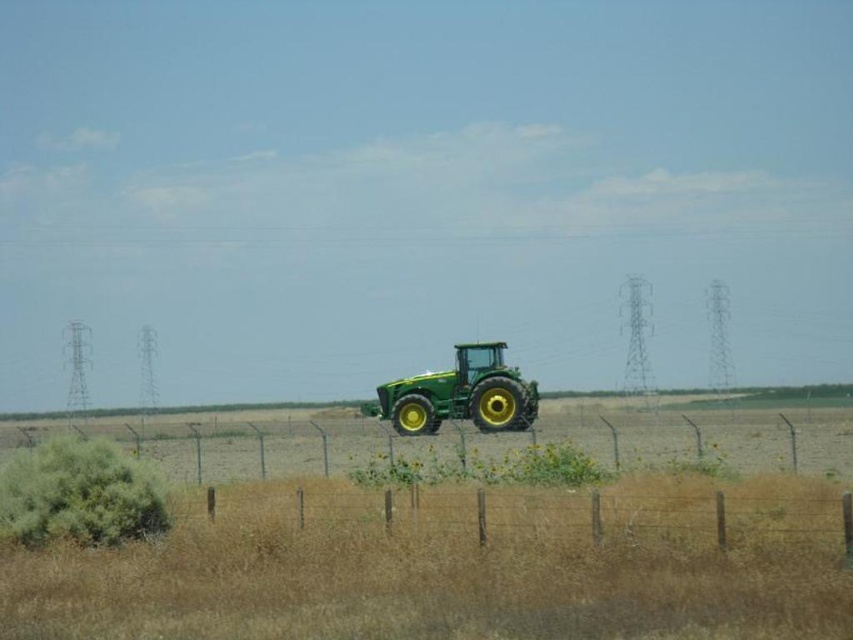
Which is below, brown dry grass at lower center or green matte tractor at center?

green matte tractor at center

Between brown dry grass at lower center and green matte tractor at center, which one is positioned higher?

brown dry grass at lower center is above.

Is point (236, 502) behind point (506, 410)?

No, (236, 502) is in front of (506, 410).

Where is `brown dry grass at lower center`? The height and width of the screenshot is (640, 853). brown dry grass at lower center is located at coordinates (447, 572).

Is brown dry grass at lower center to the left of metal wire fence at center from the viewer's perspective?

Incorrect, brown dry grass at lower center is not on the left side of metal wire fence at center.

Does brown dry grass at lower center have a greater width compared to metal wire fence at center?

Incorrect, brown dry grass at lower center's width does not surpass metal wire fence at center's.

Is point (625, 563) positioned after point (120, 436)?

No.

I want to click on brown dry grass at lower center, so click(447, 572).

Which is below, brown wire fence at center or metal wire fence at center?

metal wire fence at center is below.

Does brown wire fence at center have a smaller size compared to metal wire fence at center?

Yes.

The height and width of the screenshot is (640, 853). I want to click on brown wire fence at center, so click(x=537, y=513).

Locate an element on the screen. Image resolution: width=853 pixels, height=640 pixels. brown wire fence at center is located at coordinates (537, 513).